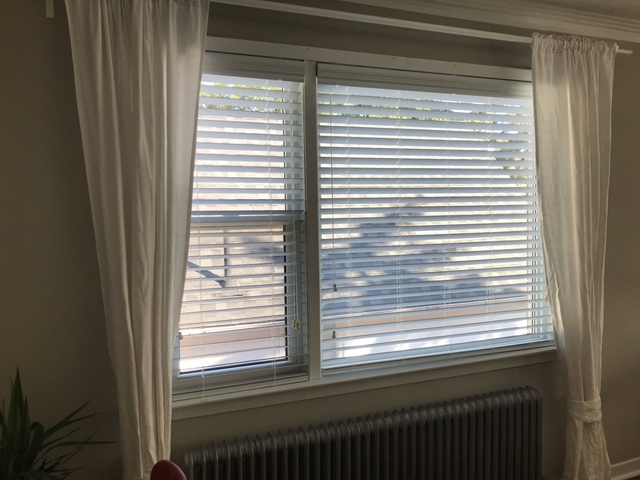
At what (x,y) coordinates should I click in order to perform the action: click on trim of ceiling. Please return your answer as a coordinate pair (x, y). The height and width of the screenshot is (480, 640). Looking at the image, I should click on (569, 25).